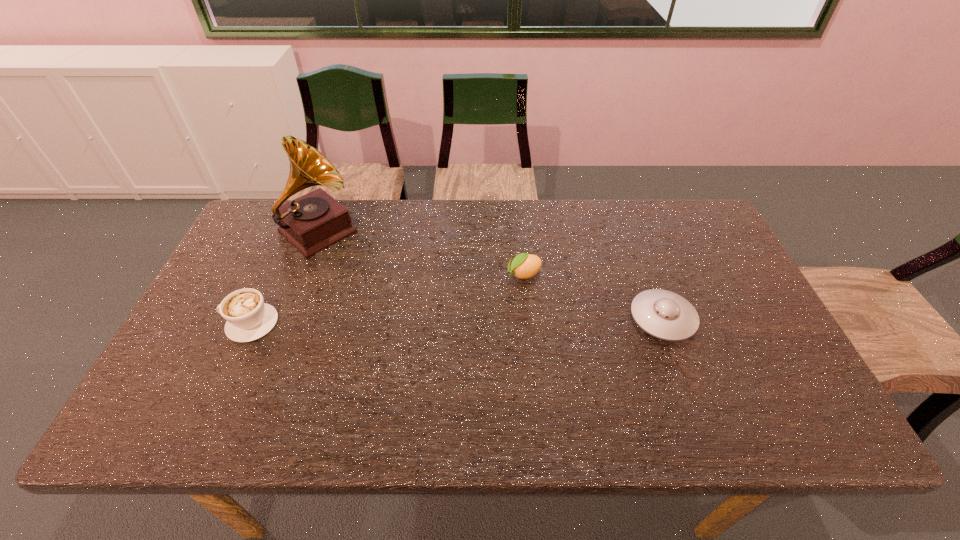
This screenshot has height=540, width=960. I want to click on vacant space located from the horn of the tallest object, so click(x=405, y=306).

At what (x,y) coordinates should I click in order to perform the action: click on free region located with leaves positioned above the third nearest object. Please return your answer as a coordinate pair (x, y). Looking at the image, I should click on (471, 299).

Where is `free region located with leaves positioned above the third nearest object`? The width and height of the screenshot is (960, 540). free region located with leaves positioned above the third nearest object is located at coordinates (419, 323).

The height and width of the screenshot is (540, 960). Find the location of `vacant space positioned 0.080m with leaves positioned above the third nearest object`. vacant space positioned 0.080m with leaves positioned above the third nearest object is located at coordinates (487, 291).

Identify the location of object that is at the far edge. (314, 221).

The width and height of the screenshot is (960, 540). I want to click on cappuccino situated at the left edge, so click(x=248, y=318).

Locate an element on the screen. Image resolution: width=960 pixels, height=540 pixels. phonograph record present at the left edge is located at coordinates (314, 221).

Identify the location of object that is at the far left corner. Image resolution: width=960 pixels, height=540 pixels. (314, 221).

Identify the location of free region at the far edge. (372, 203).

Locate an element on the screen. The height and width of the screenshot is (540, 960). blank space at the near edge of the desktop is located at coordinates (494, 385).